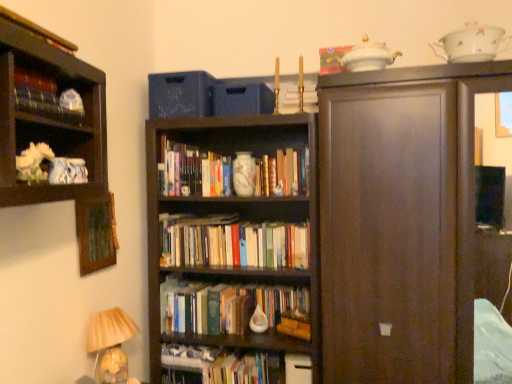
Question: From the image's perspective, would you say hardcover books at center, which ranks as the second book in bottom-to-top order, is shown under translucent glass lampshade at lower left?

Choices:
 (A) yes
 (B) no

Answer: (B)

Question: From the image's perspective, is hardcover books at center, acting as the fourth book starting from the front, on translucent glass lampshade at lower left?

Choices:
 (A) no
 (B) yes

Answer: (B)

Question: From a real-world perspective, is hardcover books at center, acting as the fourth book starting from the front, on translucent glass lampshade at lower left?

Choices:
 (A) yes
 (B) no

Answer: (A)

Question: From a real-world perspective, is hardcover books at center, the 3th book in the top-to-bottom sequence, physically below translucent glass lampshade at lower left?

Choices:
 (A) yes
 (B) no

Answer: (B)

Question: Does hardcover books at center, which ranks as the 3th book in right-to-left order, have a lesser height compared to translucent glass lampshade at lower left?

Choices:
 (A) yes
 (B) no

Answer: (A)

Question: Is dark wood cupboard at right wider or thinner than hardcover book at center?

Choices:
 (A) thin
 (B) wide

Answer: (B)

Question: From a real-world perspective, is dark wood cupboard at right physically located above or below hardcover book at center?

Choices:
 (A) below
 (B) above

Answer: (B)

Question: Relative to hardcover book at center, is dark wood cupboard at right in front or behind?

Choices:
 (A) behind
 (B) front

Answer: (B)

Question: Based on their positions, is dark wood cupboard at right located to the left or right of hardcover book at center?

Choices:
 (A) left
 (B) right

Answer: (B)

Question: In the image, is wooden picture frame at upper left on the left side or the right side of blue textured baskets at upper center?

Choices:
 (A) right
 (B) left

Answer: (B)

Question: Does point (87, 200) appear closer or farther from the camera than point (194, 76)?

Choices:
 (A) closer
 (B) farther

Answer: (A)

Question: From a real-world perspective, relative to blue textured baskets at upper center, is wooden picture frame at upper left vertically above or below?

Choices:
 (A) below
 (B) above

Answer: (A)

Question: Considering the positions of wooden picture frame at upper left and blue textured baskets at upper center in the image, is wooden picture frame at upper left taller or shorter than blue textured baskets at upper center?

Choices:
 (A) tall
 (B) short

Answer: (A)

Question: From a real-world perspective, is gold metallic candlestick at upper center, which is counted as the 4th book, starting from the left, above or below hardcover book at center?

Choices:
 (A) above
 (B) below

Answer: (A)

Question: Does point (296, 97) appear closer or farther from the camera than point (290, 375)?

Choices:
 (A) closer
 (B) farther

Answer: (A)